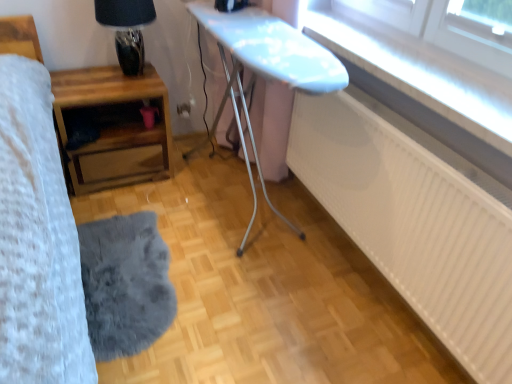
Locate an element on the screen. The height and width of the screenshot is (384, 512). empty space that is ontop of wooden nightstand at left, which appears as the first table when viewed from the left is located at coordinates point(102,84).